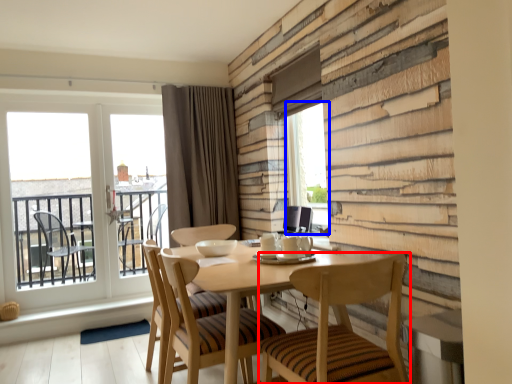
Question: Among these objects, which one is farthest to the camera, chair (highlighted by a red box) or window screen (highlighted by a blue box)?

Choices:
 (A) chair
 (B) window screen

Answer: (B)